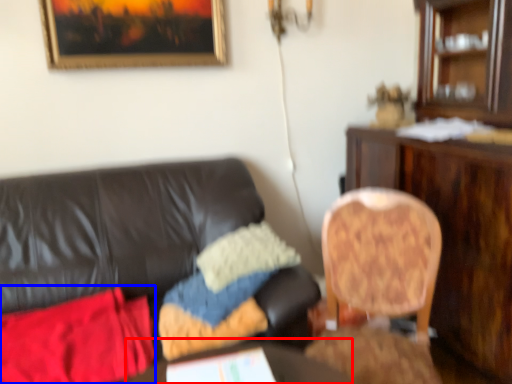
Question: Among these objects, which one is nearest to the camera, round table (highlighted by a red box) or material (highlighted by a blue box)?

Choices:
 (A) round table
 (B) material

Answer: (A)